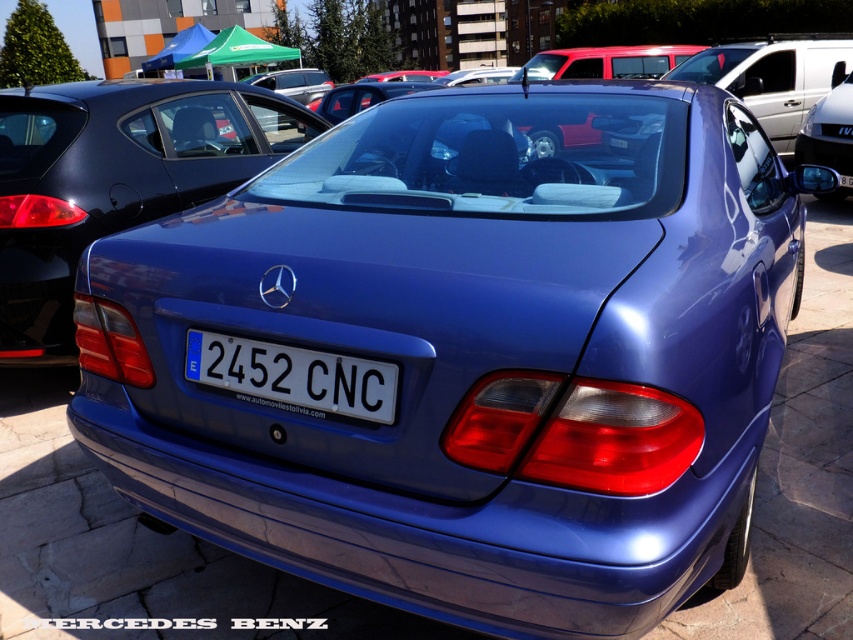
You are a parking attendant trying to fit a new car into a parking spot that is exactly the same width as the black plastic license plate at center. Can the metallic blue sedan at center fit into this parking spot?

The metallic blue sedan at center is wider than the black plastic license plate at center, so it cannot fit into the parking spot designed for the license plate width.

You are standing at the back of the blue Mercedes Benz car and looking towards the tents. There are two points marked on the ground in front of you, point (55,118) and point (851,166). Which point is closer to you?

Point (55,118) is closer to you because it is in front of point (851,166).